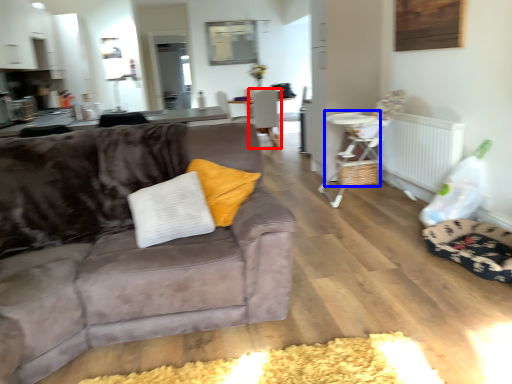
Question: Which object is further to the camera taking this photo, chair (highlighted by a red box) or table (highlighted by a blue box)?

Choices:
 (A) chair
 (B) table

Answer: (A)